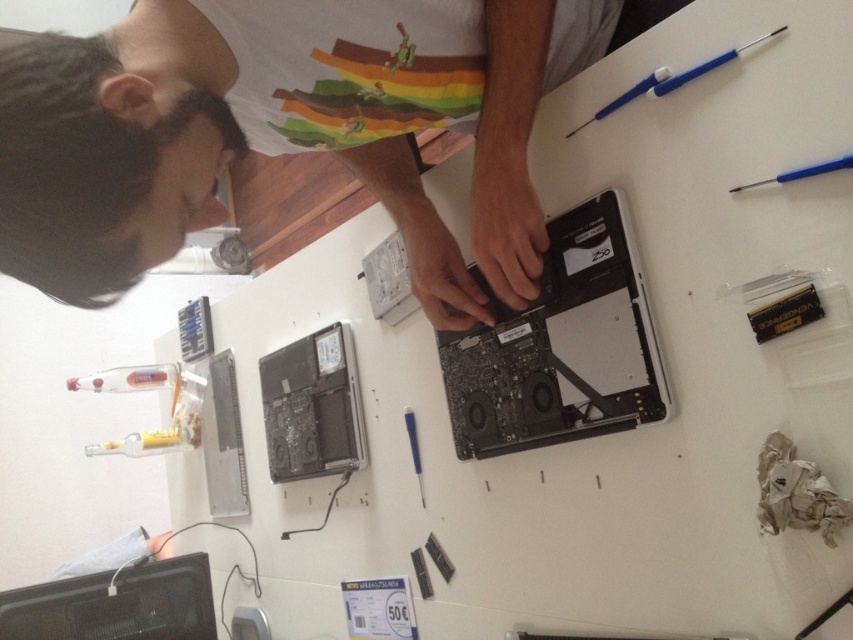
This screenshot has height=640, width=853. What do you see at coordinates (277, 129) in the screenshot?
I see `white matte shirt at upper center` at bounding box center [277, 129].

Which is in front, point (492, 278) or point (764, 184)?

Point (764, 184)

At what (x,y) coordinates should I click in order to perform the action: click on white matte shirt at upper center. Please return your answer as a coordinate pair (x, y). The image size is (853, 640). Looking at the image, I should click on (277, 129).

Does black plastic computer at center appear on the right side of blue plastic pen at upper right?

In fact, black plastic computer at center is to the left of blue plastic pen at upper right.

Does black plastic computer at center have a lesser height compared to blue plastic pen at upper right?

No, black plastic computer at center is not shorter than blue plastic pen at upper right.

The width and height of the screenshot is (853, 640). I want to click on black plastic computer at center, so click(x=560, y=346).

In order to click on black plastic computer at center in this screenshot , I will do `click(560, 346)`.

Is white matte shirt at upper center further to the viewer compared to black plastic computer at center?

No, white matte shirt at upper center is in front of black plastic computer at center.

Who is lower down, white matte shirt at upper center or black plastic computer at center?

black plastic computer at center is lower down.

Between point (311, 4) and point (660, 371), which one is positioned in front?

Positioned in front is point (311, 4).

Locate an element on the screen. The width and height of the screenshot is (853, 640). white matte shirt at upper center is located at coordinates (277, 129).